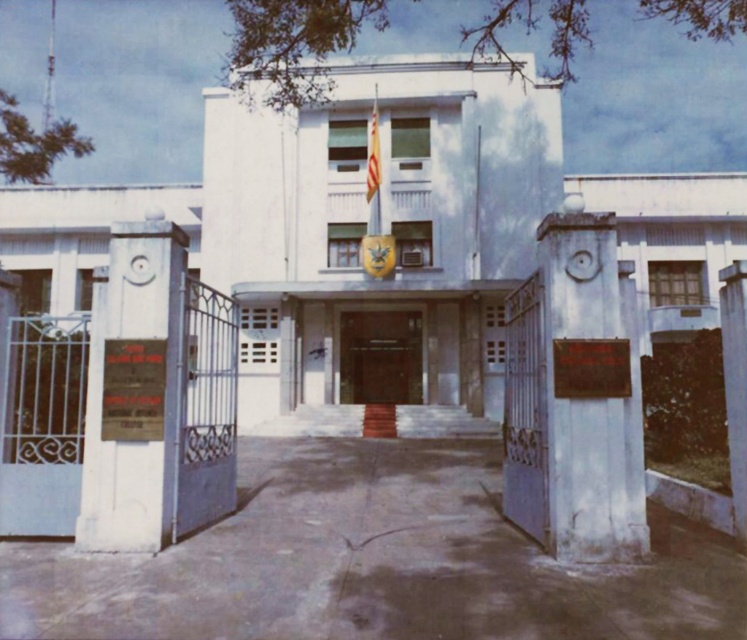
You are a delivery person arriving at this building and need to locate the entrance. You see a white stone plaque at left and a brown wooden door at center. Which object is narrower?

The white stone plaque at left is thinner than the brown wooden door at center, so the white stone plaque at left is narrower.

You are standing at the entrance of the building and see a point marked at coordinates (133,392). What object is located at this point?

The point at (133,392) marks the location of the white stone plaque at left.

In the scene shown: You are a visitor approaching the entrance of the building. You notice a white stone plaque at left and a brown wooden door at center. Which object is smaller in size?

The white stone plaque at left is smaller than the brown wooden door at center.